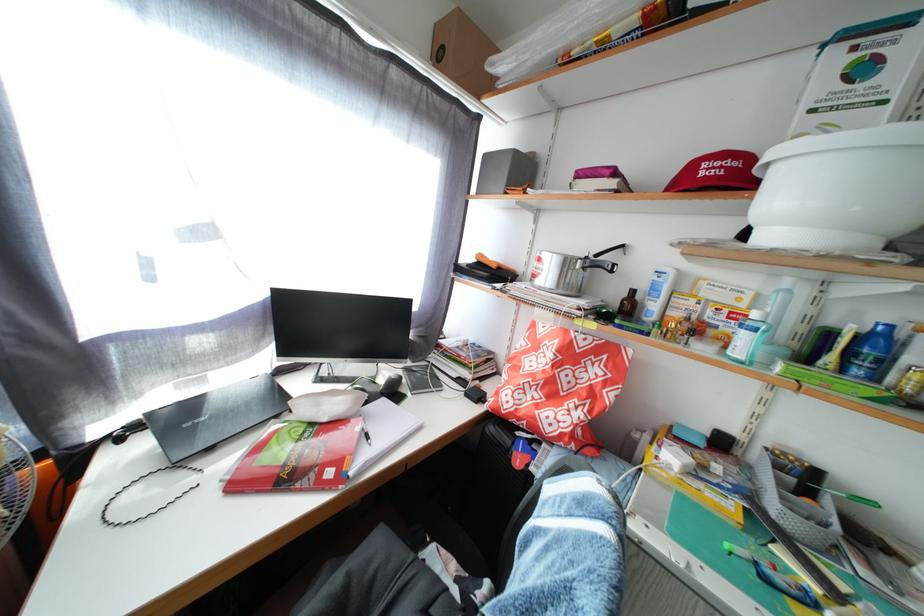
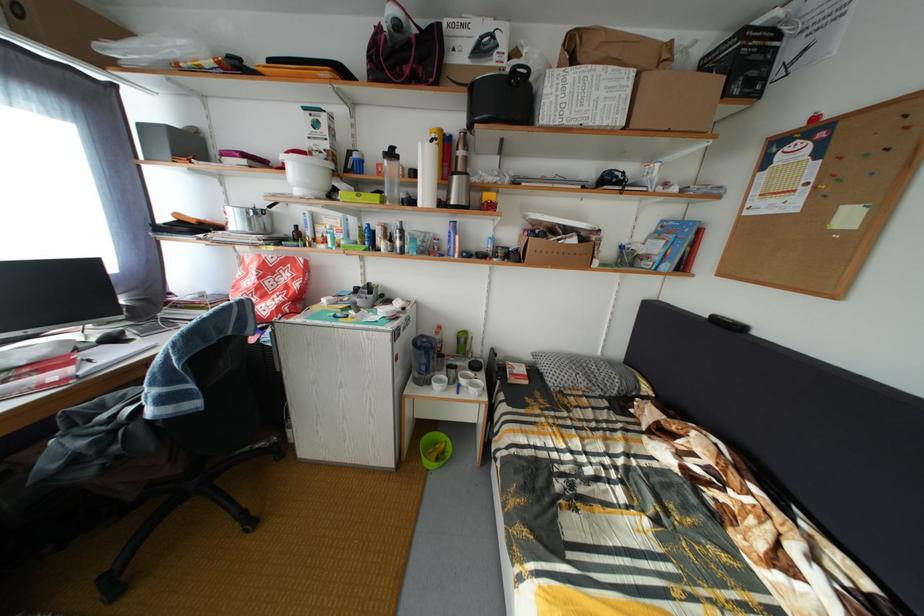
The point at (590,350) is marked in the first image. Where is the corresponding point in the second image?

(281, 267)